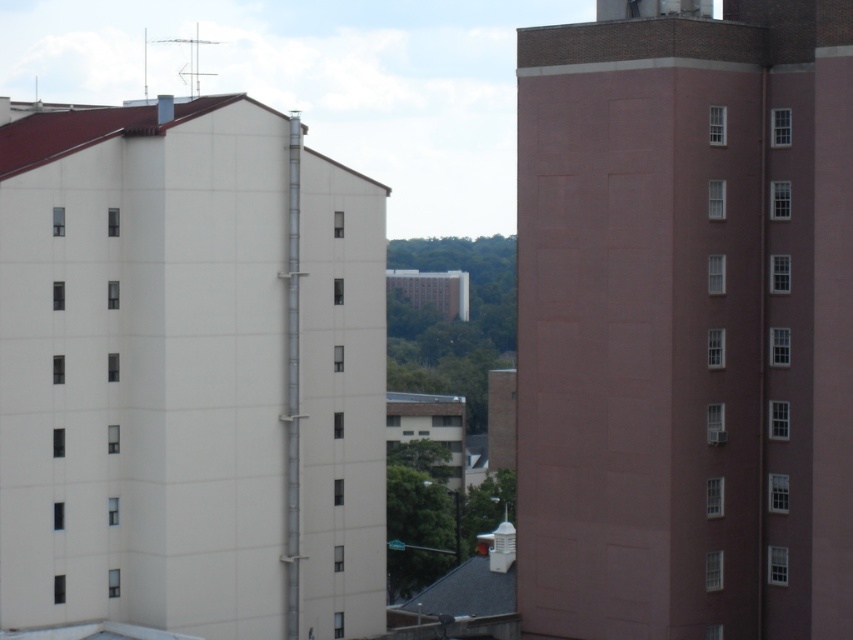
You are a city planner reviewing this urban layout. You notice the smooth pink building at right and the white smooth building at left. Based on their positions, which building is closer to the ground level?

The smooth pink building at right is positioned under the white smooth building at left, so it is closer to the ground level.

You are a city planner reviewing this urban layout. Given the coordinates of the smooth pink building at right, which is located at point 0.503, 0.804, can you determine if it is positioned closer to the center of the image compared to the white building on the left?

The smooth pink building at right is positioned at point (685, 321), which places it closer to the center of the image than the white building on the left.